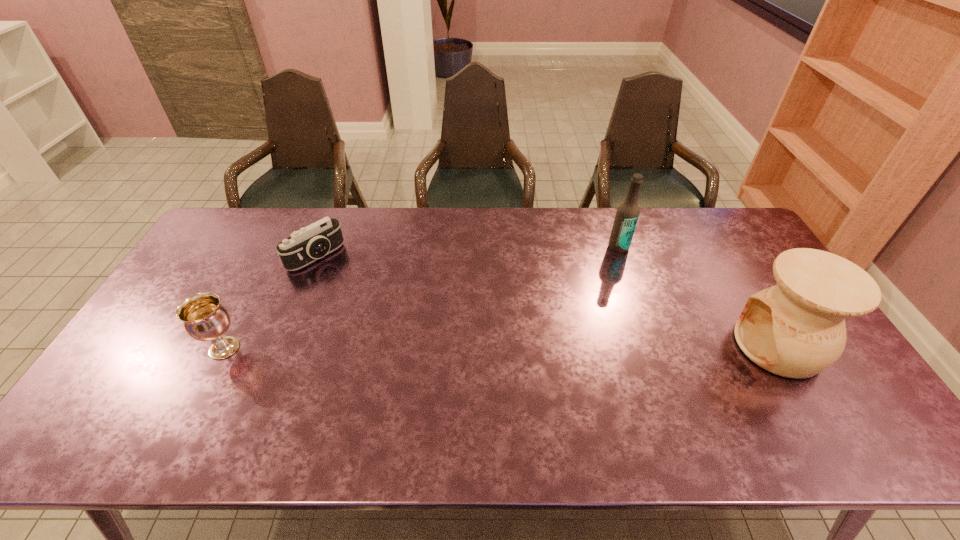
Locate an element on the screen. The image size is (960, 540). free spot between the chalice and the pottery is located at coordinates pos(501,347).

Find the location of a particular element. The height and width of the screenshot is (540, 960). vacant point located between the beer bottle and the leftmost object is located at coordinates (421, 298).

You are a GUI agent. You are given a task and a screenshot of the screen. Output one action in this format:
    pyautogui.click(x=<x>, y=<y>)
    Task: Click on the free space that is in between the third tallest object and the camera
    
    Given the screenshot: What is the action you would take?
    pyautogui.click(x=271, y=302)

In order to click on free space that is in between the third object from right to left and the beer bottle in this screenshot , I will do `click(468, 252)`.

In order to click on free spot between the camera and the pottery in this screenshot , I will do `click(547, 301)`.

This screenshot has height=540, width=960. Identify the location of vacant area that lies between the leftmost object and the camera. (271, 302).

Select which object appears as the closest to the pottery. Please provide its 2D coordinates. Your answer should be formatted as a tuple, i.e. [(x, y)], where the tuple contains the x and y coordinates of a point satisfying the conditions above.

[(627, 214)]

Identify the location of object that is the second closest to the rightmost object. (303, 247).

Where is `free space in the image that satisfies the following two spatial constraints: 1. on the back side of the shortest object; 2. on the left side of the beer bottle`? free space in the image that satisfies the following two spatial constraints: 1. on the back side of the shortest object; 2. on the left side of the beer bottle is located at coordinates (320, 247).

The height and width of the screenshot is (540, 960). Find the location of `vacant region that satisfies the following two spatial constraints: 1. on the back side of the chalice; 2. on the left side of the third object from right to left`. vacant region that satisfies the following two spatial constraints: 1. on the back side of the chalice; 2. on the left side of the third object from right to left is located at coordinates (272, 256).